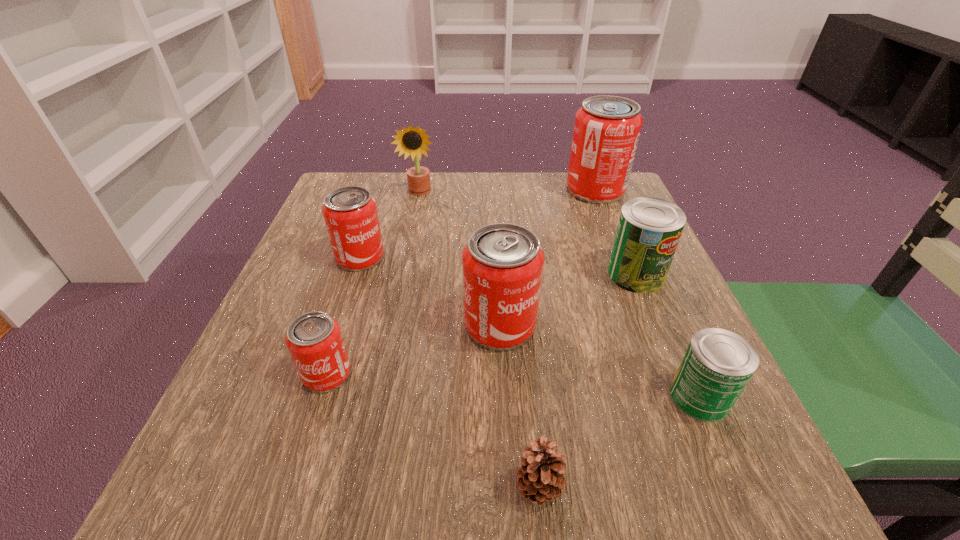
Point out which red can is positioned as the third nearest to the fifth shortest can. Please provide its 2D coordinates. Your answer should be formatted as a tuple, i.e. [(x, y)], where the tuple contains the x and y coordinates of a point satisfying the conditions above.

[(606, 132)]

Identify the location of free spot that satisfies the following two spatial constraints: 1. on the front side of the farther green can; 2. on the left side of the nearer green can. (686, 396).